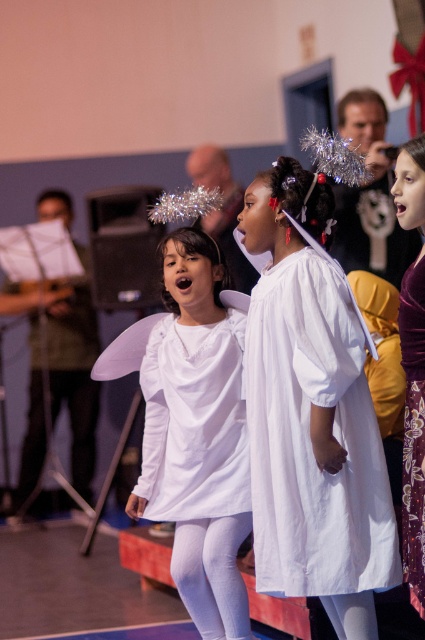
Question: Considering the relative positions of white cotton dress at center and velvet purple dress at right in the image provided, where is white cotton dress at center located with respect to velvet purple dress at right?

Choices:
 (A) above
 (B) below

Answer: (B)

Question: Which point is closer to the camera taking this photo?

Choices:
 (A) [x=240, y=465]
 (B) [x=399, y=205]

Answer: (B)

Question: Can you confirm if white cotton dress at center is bigger than white matte dress at center?

Choices:
 (A) yes
 (B) no

Answer: (A)

Question: From the image, what is the correct spatial relationship of white cotton dress at center in relation to white matte dress at center?

Choices:
 (A) right
 (B) left

Answer: (A)

Question: Which of the following is the farthest from the observer?

Choices:
 (A) velvet purple dress at right
 (B) white matte dress at center
 (C) white cotton dress at center

Answer: (B)

Question: Which object is positioned farthest from the white cotton dress at center?

Choices:
 (A) velvet purple dress at right
 (B) white matte dress at center

Answer: (B)